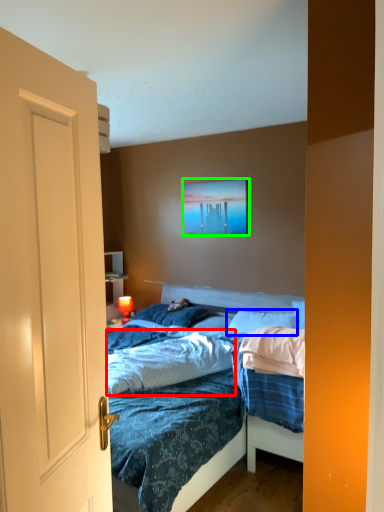
Question: Which object is positioned farthest from sheet (highlighted by a red box)? Select from pillow (highlighted by a blue box) and picture frame (highlighted by a green box).

Choices:
 (A) pillow
 (B) picture frame

Answer: (B)